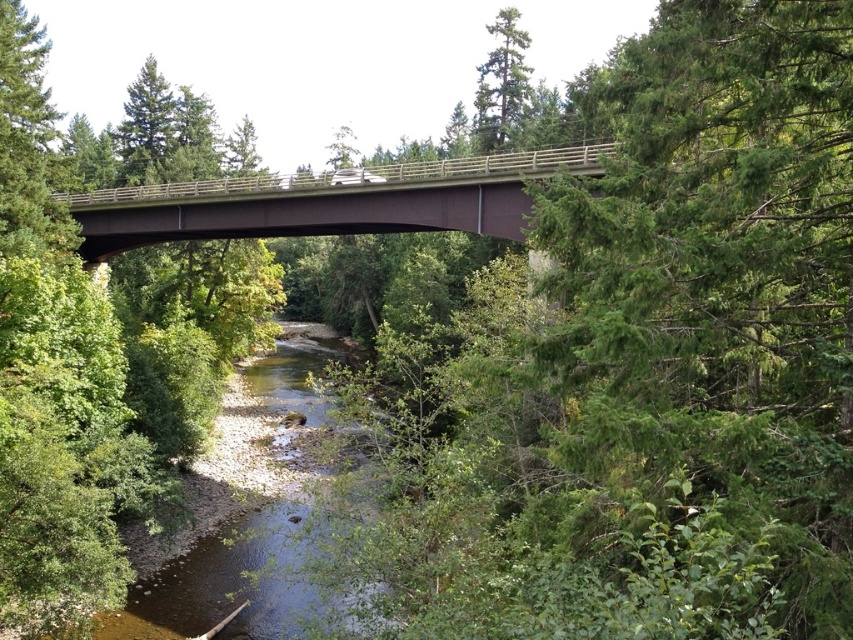
You are a hiker who wants to cross the river without getting your shoes wet. You see the clear water at center and the brown metallic bridge at center. Which path should you take to stay dry?

The clear water at center has a lesser height compared to brown metallic bridge at center. Therefore, you should take the brown metallic bridge at center to stay dry as it is elevated above the water level.

You are a photographer planning to capture both the brown metallic bridge at center and the green matte tree at upper center in a single frame. Based on their sizes in the image, which object should you focus on to ensure both fit well in the composition?

Since the brown metallic bridge at center is smaller than the green matte tree at upper center, you should focus on the green matte tree at upper center to ensure both objects fit well in the composition.

You are standing at the edge of the river and want to cross to the other side using the brown metallic bridge at center. If your walking speed is 1.2 meters per second, how many seconds will it take you to reach the bridge?

The distance between you and the brown metallic bridge at center is 10.41 meters. At a walking speed of 1.2 meters per second, it would take approximately 8.68 seconds to reach the bridge. Since you can round to the nearest whole number, it would take about 9 seconds.